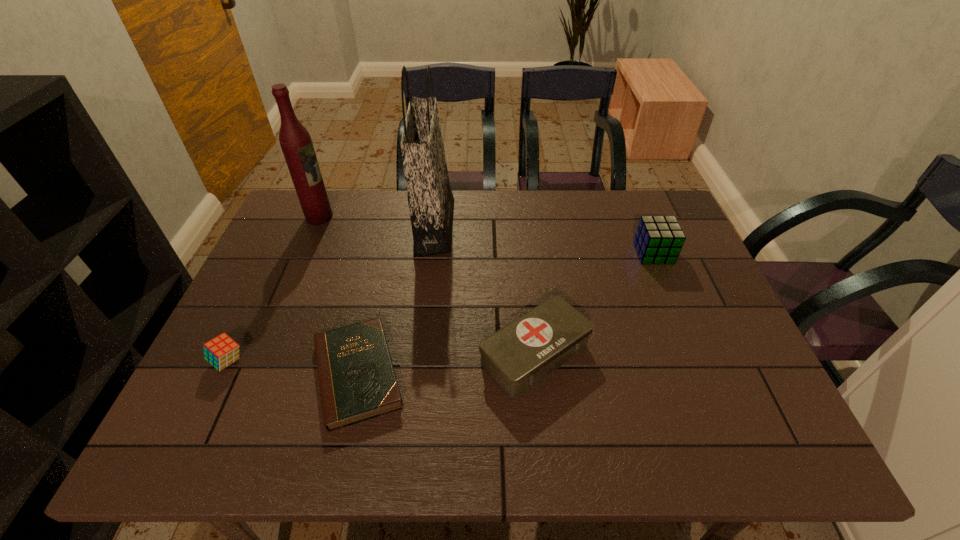
At what (x,y) coordinates should I click in order to perform the action: click on shopping bag. Please return your answer as a coordinate pair (x, y). Looking at the image, I should click on (431, 203).

At what (x,y) coordinates should I click in order to perform the action: click on liquor. Please return your answer as a coordinate pair (x, y). The height and width of the screenshot is (540, 960). Looking at the image, I should click on (295, 141).

Where is `the rightmost object`? This screenshot has width=960, height=540. the rightmost object is located at coordinates coord(658,239).

You are a GUI agent. You are given a task and a screenshot of the screen. Output one action in this format:
    pyautogui.click(x=<x>, y=<y>)
    Task: Click on the farther cube
    The height and width of the screenshot is (540, 960).
    Given the screenshot: What is the action you would take?
    pyautogui.click(x=658, y=239)

Identify the location of the first-aid kit. This screenshot has height=540, width=960. (519, 355).

The width and height of the screenshot is (960, 540). What are the coordinates of `the left cube` in the screenshot? It's located at (222, 351).

The image size is (960, 540). In order to click on the shorter cube in this screenshot , I will do `click(222, 351)`.

This screenshot has height=540, width=960. Find the location of `the shortest object`. the shortest object is located at coordinates (357, 380).

At what (x,y) coordinates should I click in order to perform the action: click on free location located on the front of the shopping bag with the design. Please return your answer as a coordinate pair (x, y). Image resolution: width=960 pixels, height=540 pixels. Looking at the image, I should click on (564, 227).

Identify the location of vacant space located 0.170m on the label of the liquor. This screenshot has height=540, width=960. (385, 217).